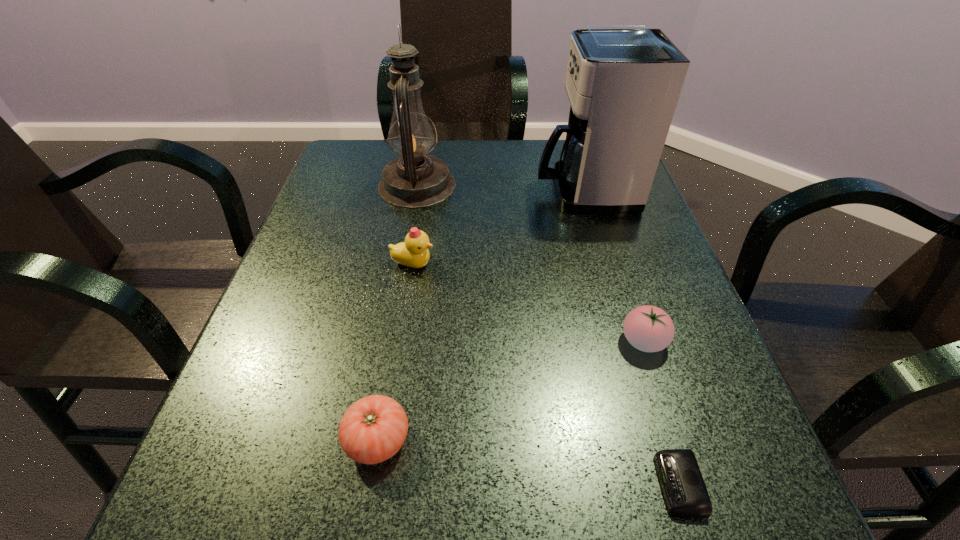
I want to click on free spot between the coffee maker and the left tomato, so pos(481,315).

Identify the location of free area in between the duckling and the fourth farthest object. (528, 303).

Identify which object is the nearest to the duckling. Please provide its 2D coordinates. Your answer should be formatted as a tuple, i.e. [(x, y)], where the tuple contains the x and y coordinates of a point satisfying the conditions above.

[(416, 180)]

The width and height of the screenshot is (960, 540). I want to click on the third closest object relative to the alarm clock, so click(x=414, y=252).

Identify the location of vacant area that satisfies the following two spatial constraints: 1. on the front panel of the coffee maker; 2. on the front side of the left tomato. (658, 440).

Locate an element on the screen. free space that satisfies the following two spatial constraints: 1. on the front-facing side of the third tallest object; 2. on the back side of the right tomato is located at coordinates (401, 341).

In order to click on free spot that satisfies the following two spatial constraints: 1. on the back side of the right tomato; 2. on the right side of the left tomato in this screenshot , I will do `click(395, 341)`.

Locate an element on the screen. Image resolution: width=960 pixels, height=540 pixels. free location that satisfies the following two spatial constraints: 1. on the front-facing side of the third farthest object; 2. on the left side of the right tomato is located at coordinates (401, 341).